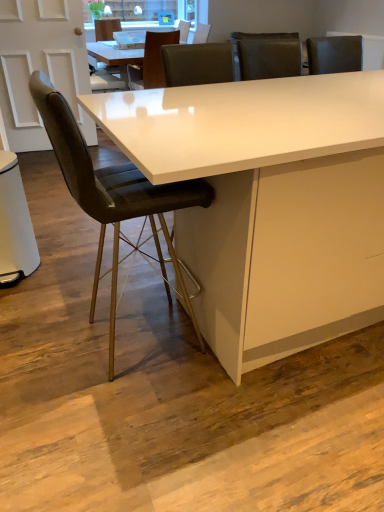
Question: Is matte black chair at upper center, the third chair in the bottom-to-top sequence, taller or shorter than leather-like black chair at left, which is the 3th chair from top to bottom?

Choices:
 (A) tall
 (B) short

Answer: (B)

Question: Is point (104, 31) closer or farther from the camera than point (91, 204)?

Choices:
 (A) farther
 (B) closer

Answer: (A)

Question: Estimate the real-world distances between objects in this image. Which object is closer to the white glossy table at center?

Choices:
 (A) leather-like black chair at left, arranged as the third chair when viewed from the back
 (B) matte black chair at upper center, positioned as the third chair in front-to-back order
 (C) leather at center, the 2th chair in the bottom-to-top sequence

Answer: (A)

Question: Estimate the real-world distances between objects in this image. Which object is farther from the leather at center, the 2th chair from the front?

Choices:
 (A) leather-like black chair at left, the first chair from the front
 (B) matte black chair at upper center, positioned as the third chair in front-to-back order
 (C) white glossy table at center

Answer: (C)